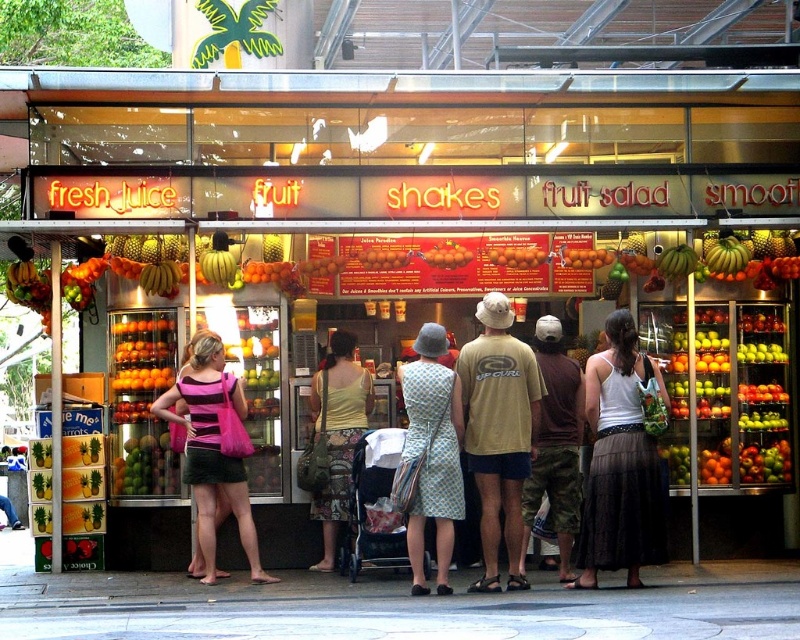
What is located at the coordinate point (x=432, y=452) in the image?

The printed fabric dress at center is located at the coordinate point (x=432, y=452).